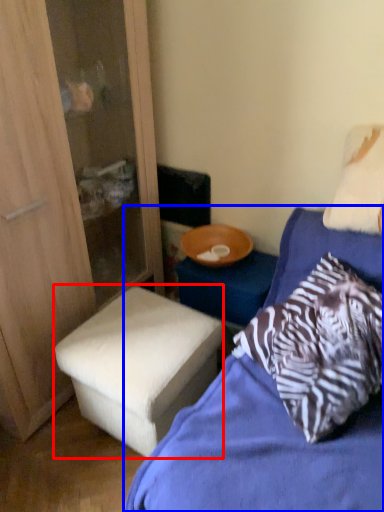
Question: Among these objects, which one is nearest to the camera, stool (highlighted by a red box) or bed (highlighted by a blue box)?

Choices:
 (A) stool
 (B) bed

Answer: (B)